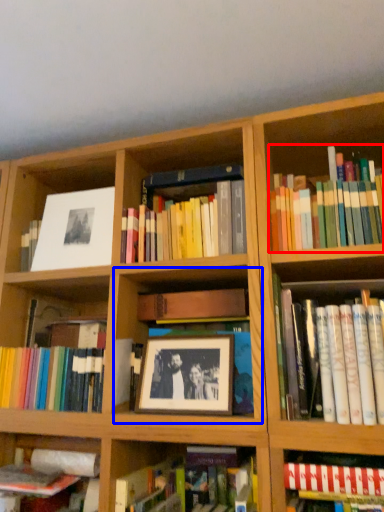
Question: Which object is closer to the camera taking this photo, book (highlighted by a red box) or cabinet (highlighted by a blue box)?

Choices:
 (A) book
 (B) cabinet

Answer: (A)